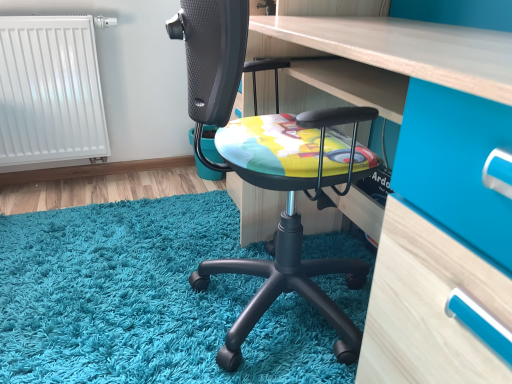
This screenshot has width=512, height=384. What do you see at coordinates (429, 307) in the screenshot?
I see `wooden desk at center` at bounding box center [429, 307].

Find the location of `wooden desk at center`. wooden desk at center is located at coordinates (429, 307).

Locate an element on the screen. wooden desk at center is located at coordinates (429, 307).